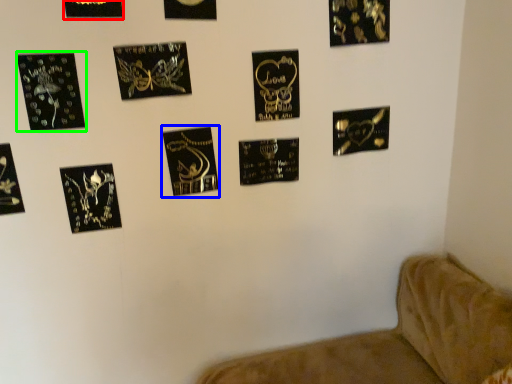
Question: Which object is positioned farthest from picture frame (highlighted by a red box)? Select from picture frame (highlighted by a blue box) and picture frame (highlighted by a green box).

Choices:
 (A) picture frame
 (B) picture frame

Answer: (A)